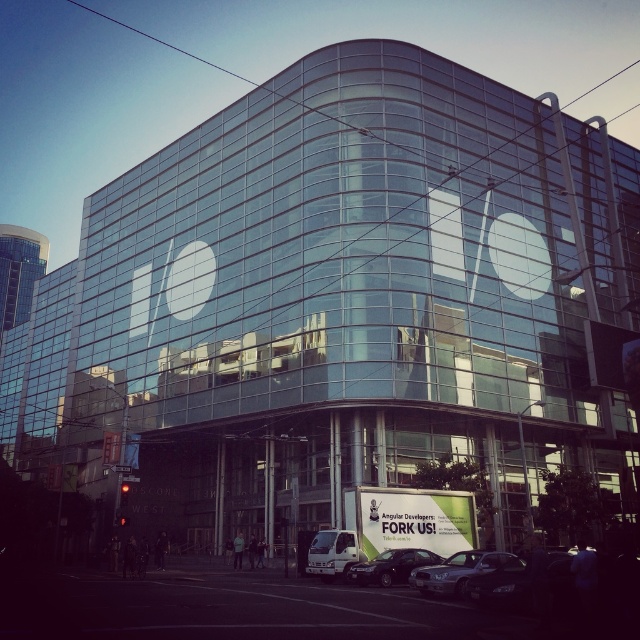
Question: Is shiny black sedan at lower center bigger than shiny black sedan at center?

Choices:
 (A) no
 (B) yes

Answer: (A)

Question: Which object appears farthest from the camera in this image?

Choices:
 (A) white metallic van at center
 (B) shiny black sedan at lower center
 (C) metallic silver sedan at center

Answer: (A)

Question: Which object appears farthest from the camera in this image?

Choices:
 (A) metallic silver sedan at center
 (B) shiny black sedan at center

Answer: (B)

Question: Is shiny black sedan at center thinner than white metallic van at center?

Choices:
 (A) no
 (B) yes

Answer: (B)

Question: Does metallic silver sedan at center have a greater width compared to white metallic van at center?

Choices:
 (A) no
 (B) yes

Answer: (B)

Question: Which point is closer to the camera?

Choices:
 (A) metallic silver sedan at center
 (B) shiny black sedan at lower center
 (C) shiny black sedan at center

Answer: (B)